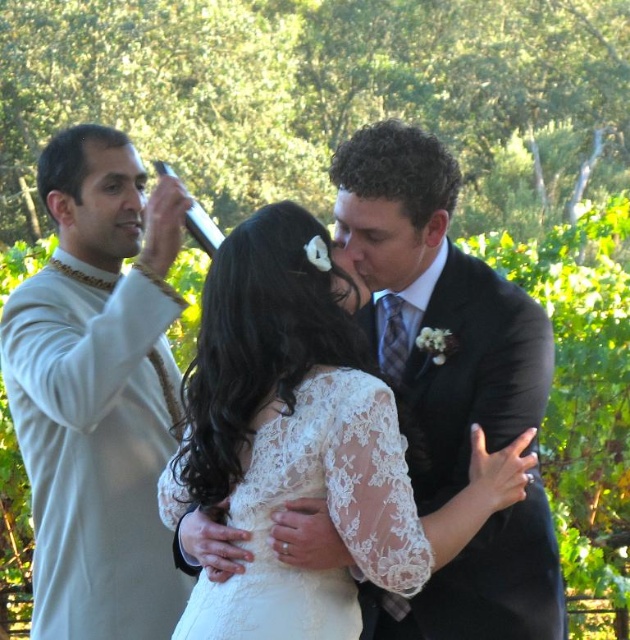
Does white textured sweater at left appear over white lace dress at center?

Yes, white textured sweater at left is above white lace dress at center.

The image size is (630, 640). Find the location of `white textured sweater at left`. white textured sweater at left is located at coordinates (98, 392).

Who is more distant from viewer, (x=71, y=428) or (x=542, y=353)?

The point (x=71, y=428) is behind.

You are a GUI agent. You are given a task and a screenshot of the screen. Output one action in this format:
    pyautogui.click(x=<x>, y=<y>)
    Task: Click on the white textured sweater at left
    
    Given the screenshot: What is the action you would take?
    pyautogui.click(x=98, y=392)

Between white lace dress at center and lace/embroidered dress at center, which one has less height?

Standing shorter between the two is lace/embroidered dress at center.

Consider the image. Measure the distance between point [399,604] and camera.

Point [399,604] is 2.94 meters from camera.

Image resolution: width=630 pixels, height=640 pixels. Identify the location of white lace dress at center. (437, 307).

Who is more forward, (93, 212) or (375, 461)?

Positioned in front is point (375, 461).

Is white textured sweater at left positioned behind lace/embroidered dress at center?

Yes, it is.

Locate an element on the screen. white textured sweater at left is located at coordinates (98, 392).

The width and height of the screenshot is (630, 640). I want to click on white textured sweater at left, so click(98, 392).